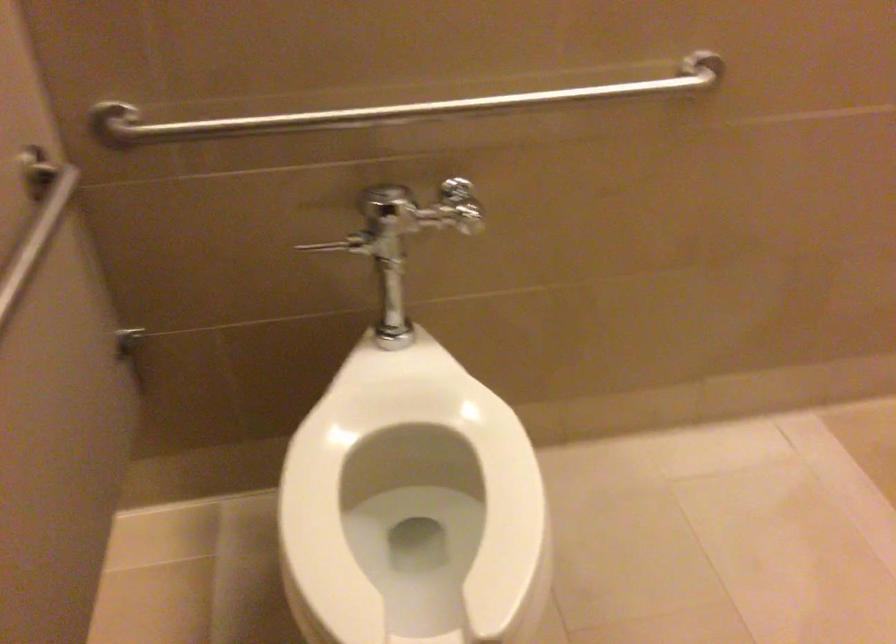
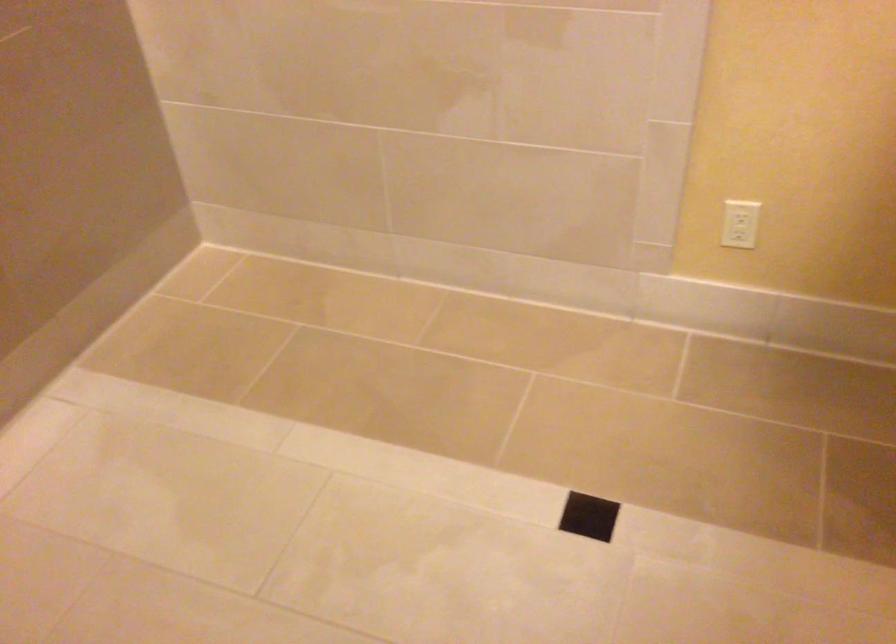
Question: The camera is either moving clockwise (left) or counter-clockwise (right) around the object. The first image is from the beginning of the video and the second image is from the end. Is the camera moving left or right when shooting the video?

Choices:
 (A) Left
 (B) Right

Answer: (A)